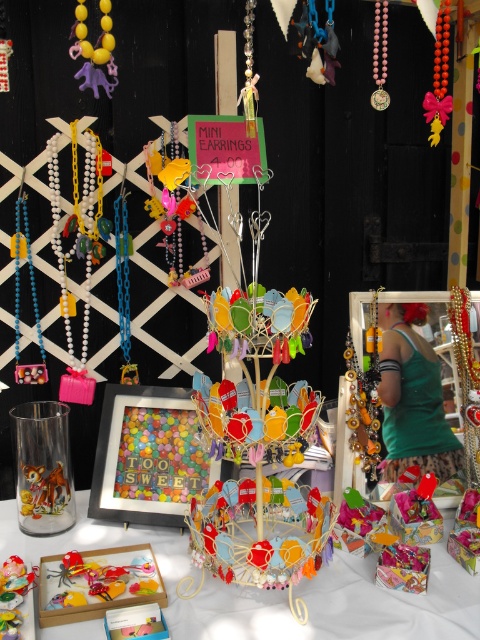
Is point (334, 632) less distant than point (108, 36)?

Yes.

Consider the image. Between matte plastic jewelry at center and matte yellow plastic elephant at upper left, which one has more height?

matte yellow plastic elephant at upper left

The width and height of the screenshot is (480, 640). What are the coordinates of `matte plastic jewelry at center` in the screenshot? It's located at (276, 589).